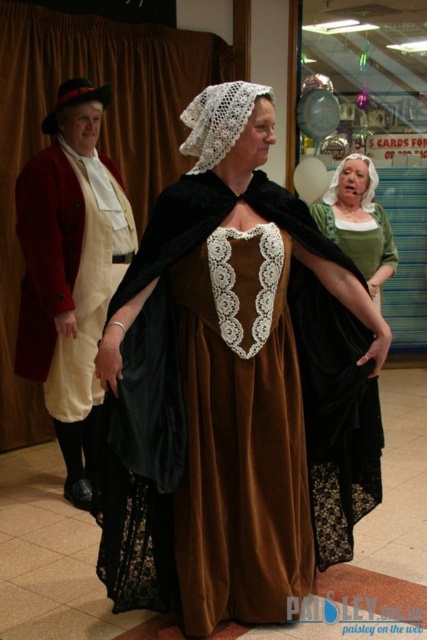
You are a costume designer preparing for a historical play. You have two dresses in the center of the stage, the brown velvet dress at center and the velvet green dress at center. The director wants to know which dress is wider. Which one should you inform them about?

The brown velvet dress at center is wider than the velvet green dress at center.

You are a costume designer preparing for a historical play. You need to arrange two costumes in a display case. The brown velvet dress at center and the matte white coat at left must be placed side by side. Based on their heights, which costume should be placed on the lower shelf to ensure proper visibility of both items?

The brown velvet dress at center has a lesser height compared to the matte white coat at left, so it should be placed on the lower shelf to ensure proper visibility of both items.